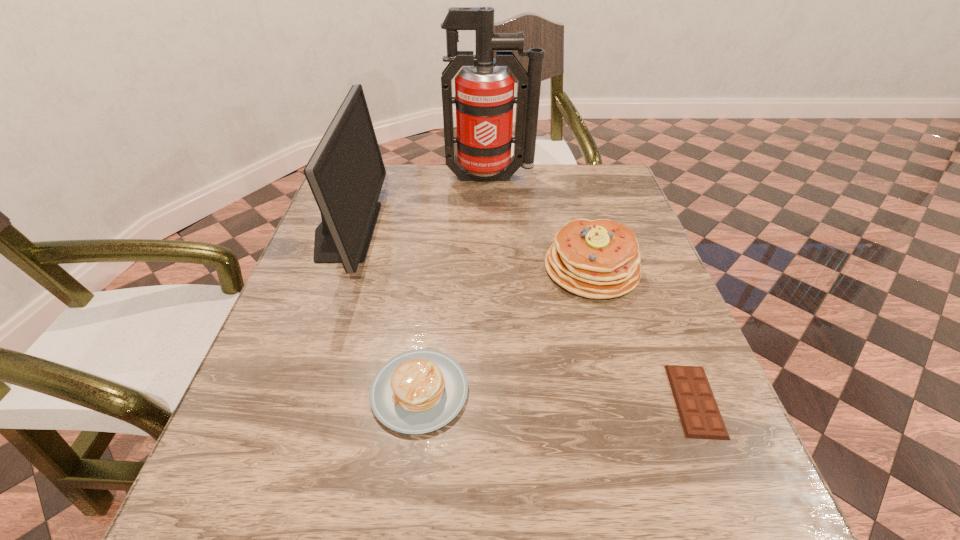
Identify the location of the tallest object. This screenshot has width=960, height=540. (484, 98).

I want to click on the leftmost object, so click(x=346, y=172).

You are a GUI agent. You are given a task and a screenshot of the screen. Output one action in this format:
    pyautogui.click(x=<x>, y=<y>)
    Task: Click on the computer monitor
    The image size is (960, 540).
    Given the screenshot: What is the action you would take?
    pyautogui.click(x=346, y=172)

Locate an element on the screen. The width and height of the screenshot is (960, 540). the farther pancake is located at coordinates (599, 259).

In order to click on the right pancake in this screenshot , I will do point(599,259).

Where is `the nearer pancake`? the nearer pancake is located at coordinates (419, 391).

Where is `the left pancake`? the left pancake is located at coordinates (419, 391).

In order to click on the shortest object in this screenshot , I will do `click(698, 411)`.

The width and height of the screenshot is (960, 540). Find the location of `free region located 0.140m on the front label side of the tallest object`. free region located 0.140m on the front label side of the tallest object is located at coordinates (492, 221).

Locate an element on the screen. The width and height of the screenshot is (960, 540). vacant region located 0.160m on the screen side of the fourth shortest object is located at coordinates (440, 231).